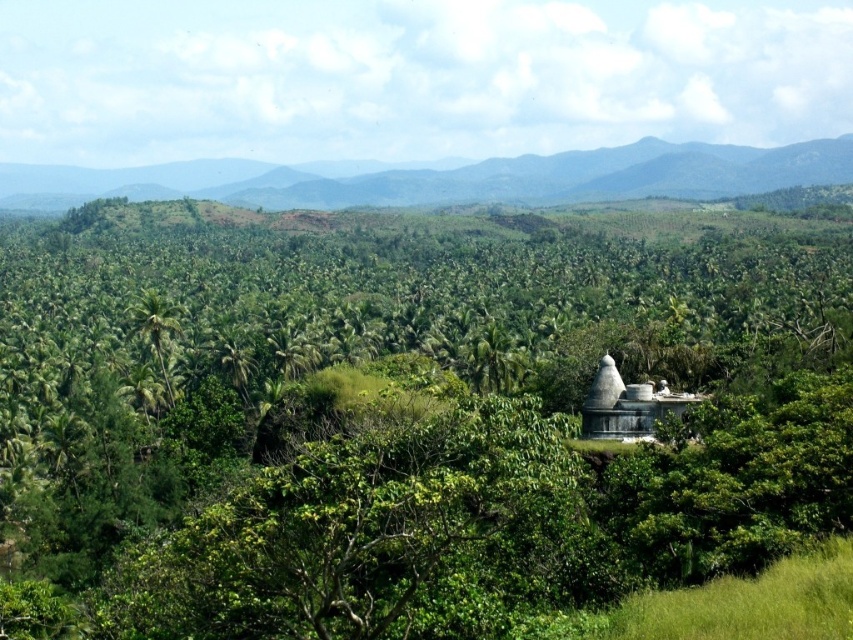
Which is in front, point (503, 307) or point (132, 330)?

Point (132, 330)

The image size is (853, 640). Find the location of `green leafy tree at center`. green leafy tree at center is located at coordinates (410, 417).

What do you see at coordinates (410, 417) in the screenshot?
I see `green leafy tree at center` at bounding box center [410, 417].

Which of these two, green leafy tree at center or green leafy mountain at upper center, stands shorter?

With less height is green leafy mountain at upper center.

Where is `green leafy tree at center`? The height and width of the screenshot is (640, 853). green leafy tree at center is located at coordinates (410, 417).

Who is positioned more to the left, green leafy mountain at upper center or green leafy palm tree at center?

Positioned to the left is green leafy palm tree at center.

Does green leafy mountain at upper center appear on the left side of green leafy palm tree at center?

Incorrect, green leafy mountain at upper center is not on the left side of green leafy palm tree at center.

Measure the distance between green leafy mountain at upper center and camera.

A distance of 1539.85 feet exists between green leafy mountain at upper center and camera.

Locate an element on the screen. green leafy mountain at upper center is located at coordinates (468, 179).